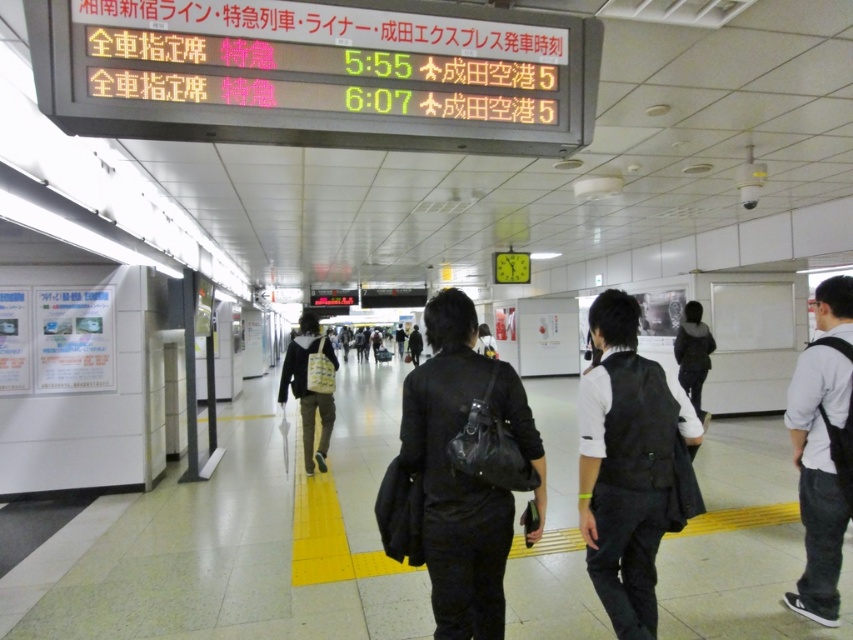
Question: Where is black matte bag at center located in relation to white cotton shirt at right in the image?

Choices:
 (A) right
 (B) left

Answer: (B)

Question: Which of the following is the closest to the observer?

Choices:
 (A) (308, 467)
 (B) (647, 548)
 (C) (830, 548)
 (D) (463, 516)

Answer: (D)

Question: Which object is farther from the camera taking this photo?

Choices:
 (A) black matte bag at center
 (B) black textured vest at center
 (C) white fabric bag at center
 (D) white cotton shirt at right

Answer: (C)

Question: Is black matte bag at center further to the viewer compared to white cotton shirt at right?

Choices:
 (A) yes
 (B) no

Answer: (B)

Question: Estimate the real-world distances between objects in this image. Which object is farther from the black matte bag at center?

Choices:
 (A) black textured vest at center
 (B) white fabric bag at center
 (C) white cotton shirt at right

Answer: (B)

Question: Can you confirm if black textured vest at center is positioned to the right of white cotton shirt at right?

Choices:
 (A) yes
 (B) no

Answer: (B)